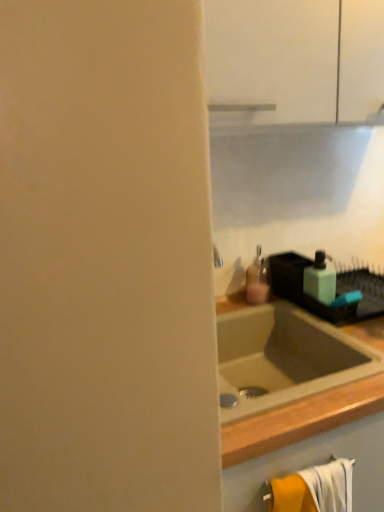
At what (x,y) coordinates should I click in order to perform the action: click on free spot in front of matte pink plastic soap dispenser at center, which is the 2th soap dispenser in right-to-left order. Please return your answer as a coordinate pair (x, y). The width and height of the screenshot is (384, 512). Looking at the image, I should click on (281, 309).